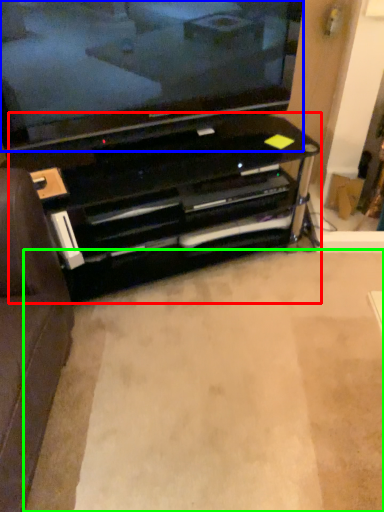
Question: Which is nearer to the entertainment center (highlighted by a red box)? television (highlighted by a blue box) or plain (highlighted by a green box).

Choices:
 (A) television
 (B) plain

Answer: (A)